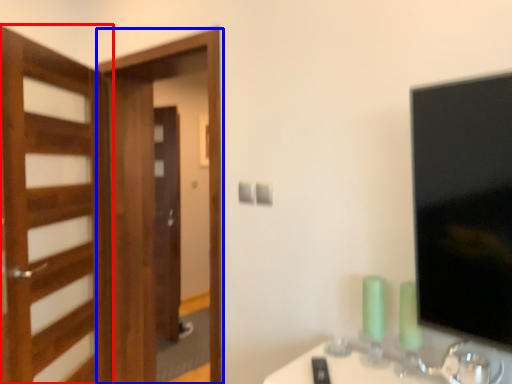
Question: Which object appears closest to the camera in this image, door (highlighted by a red box) or screen door (highlighted by a blue box)?

Choices:
 (A) door
 (B) screen door

Answer: (A)